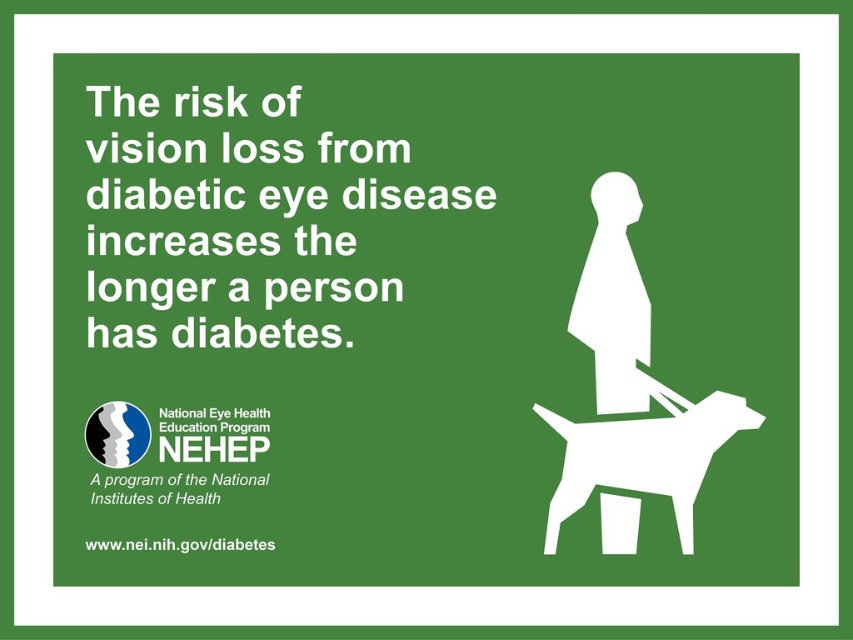
Based on the spatial arrangement in the health awareness poster, which object is positioned closer to the viewer between the white matte dog at lower right and the white matte figure at center?

The white matte dog at lower right is closer to the viewer than the white matte figure at center.

Based on the health awareness poster described, which object is wider between the white matte dog at lower right and the white matte figure at center?

The white matte dog at lower right is wider than the white matte figure at center.